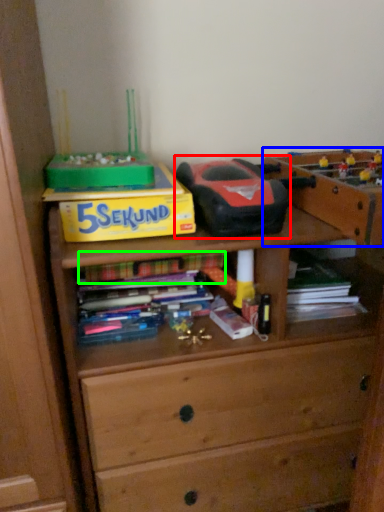
Question: Based on their relative distances, which object is farther from toy (highlighted by a red box)? Choose from cabinetry (highlighted by a blue box) and book (highlighted by a green box).

Choices:
 (A) cabinetry
 (B) book

Answer: (B)